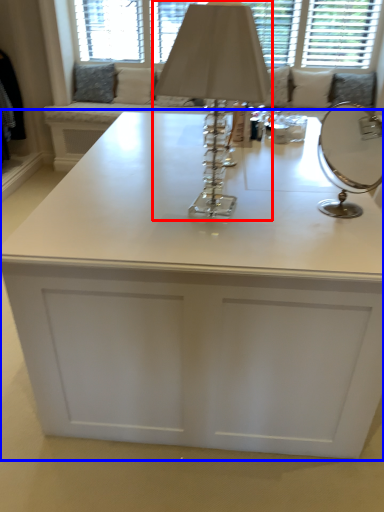
Question: Which point is closer to the camera, table lamp (highlighted by a red box) or table (highlighted by a blue box)?

Choices:
 (A) table lamp
 (B) table

Answer: (A)